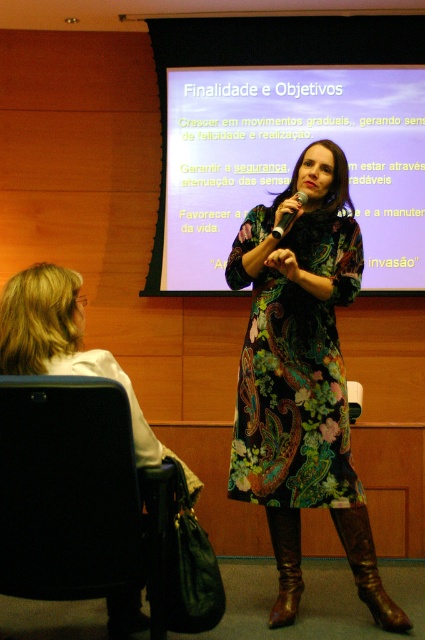
Question: Which point is closer to the camera taking this photo?

Choices:
 (A) (283, 305)
 (B) (394, 620)
 (C) (291, 529)

Answer: (B)

Question: Which object appears closest to the camera in this image?

Choices:
 (A) brown leather boot at lower right
 (B) white matte projection screen at upper center
 (C) black leather chair at lower left

Answer: (C)

Question: Among these points, which one is nearest to the camera?

Choices:
 (A) (286, 214)
 (B) (272, 518)
 (C) (297, 468)
 (D) (274, 200)

Answer: (C)

Question: Considering the relative positions of black leather chair at lower left and matte black microphone at center in the image provided, where is black leather chair at lower left located with respect to matte black microphone at center?

Choices:
 (A) left
 (B) right

Answer: (A)

Question: Is black leather chair at lower left thinner than brown leather boot at lower right?

Choices:
 (A) yes
 (B) no

Answer: (B)

Question: Observing the image, what is the correct spatial positioning of brown leather boot at lower center in reference to matte black microphone at center?

Choices:
 (A) below
 (B) above

Answer: (A)